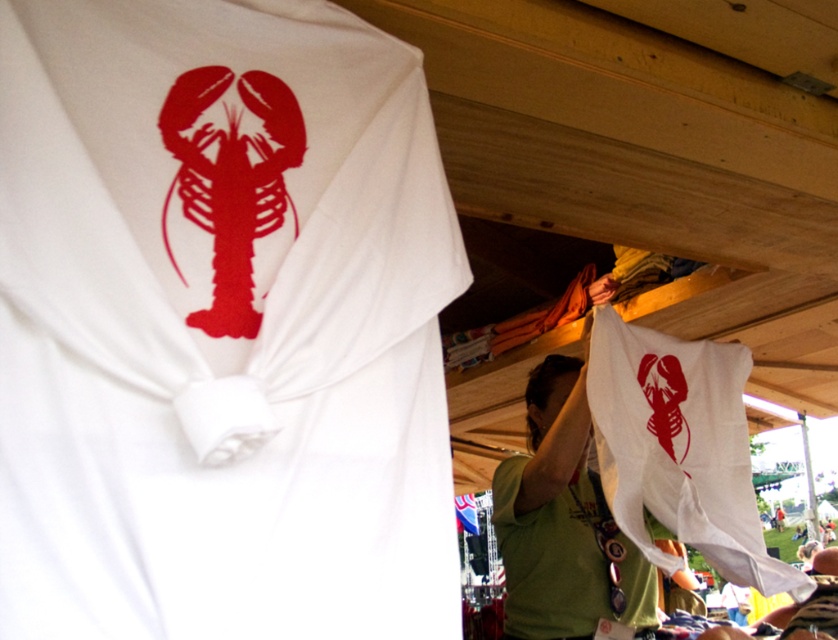
Question: Which object is closer to the camera taking this photo?

Choices:
 (A) white matte lobster at center
 (B) white matte cloth at center
 (C) white fabric bag at lower right

Answer: (A)

Question: Can you confirm if white matte lobster at center is positioned below white matte cloth at center?

Choices:
 (A) yes
 (B) no

Answer: (B)

Question: Is white matte lobster at center wider than white fabric bag at lower right?

Choices:
 (A) no
 (B) yes

Answer: (A)

Question: Which object appears farthest from the camera in this image?

Choices:
 (A) white matte lobster at center
 (B) white matte cloth at center
 (C) white fabric bag at lower right

Answer: (B)

Question: Which of these objects is positioned farthest from the white fabric bag at lower right?

Choices:
 (A) white matte cloth at center
 (B) white matte lobster at center

Answer: (B)

Question: Can you confirm if white fabric bag at lower right is bigger than white matte cloth at center?

Choices:
 (A) no
 (B) yes

Answer: (B)